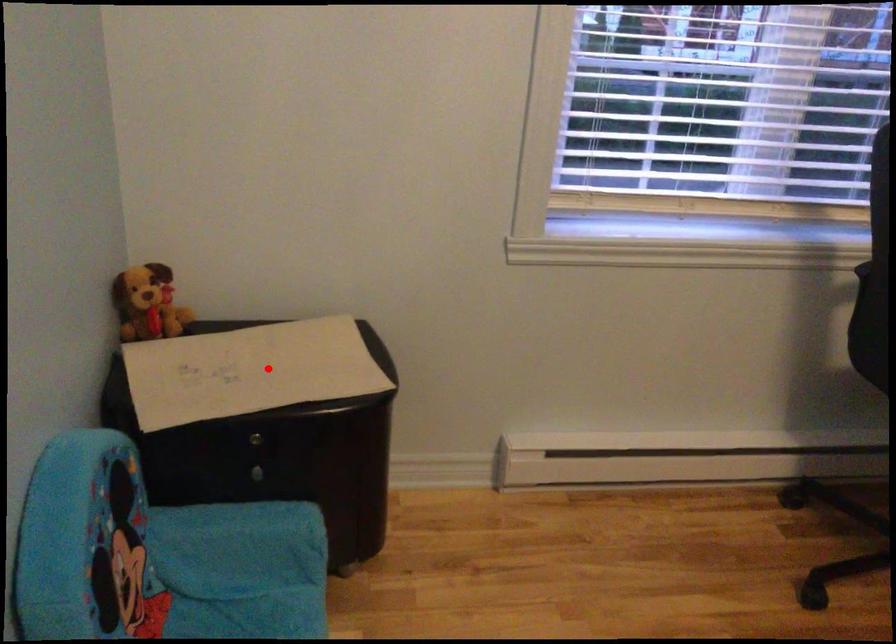
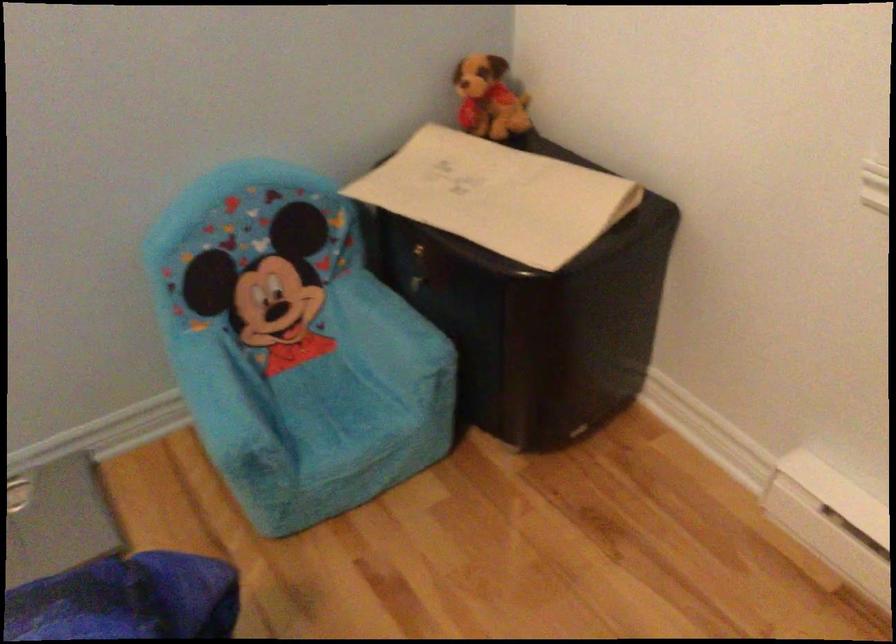
In the second image, find the point that corresponds to the highlighted location in the first image.

(497, 196)